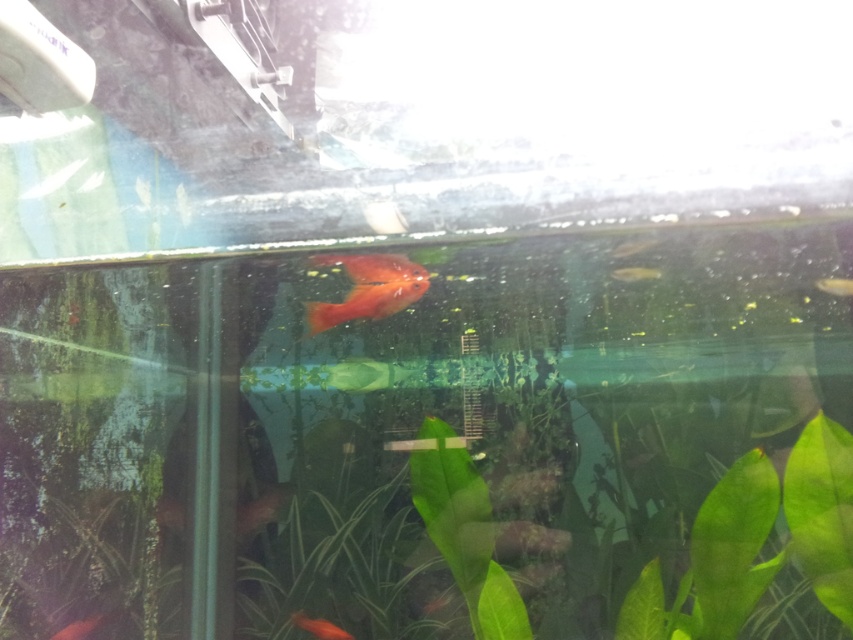
Question: Estimate the real-world distances between objects in this image. Which object is farther from the translucent yellowish-green leaf at center?

Choices:
 (A) shiny orange fish at lower left
 (B) glossy orange fish at center
 (C) shiny orange fish at bottom
 (D) translucent yellowish fish at upper right

Answer: (A)

Question: Which of the following is the farthest from the observer?

Choices:
 (A) shiny orange fish at bottom
 (B) shiny orange fish at lower left

Answer: (A)

Question: Is shiny orange fish at upper center wider than shiny orange fish at center?

Choices:
 (A) yes
 (B) no

Answer: (A)

Question: Does shiny orange fish at bottom appear on the right side of shiny orange fish at center?

Choices:
 (A) no
 (B) yes

Answer: (B)

Question: Based on their relative distances, which object is farther from the translucent yellowish-green leaf at center?

Choices:
 (A) shiny orange fish at upper center
 (B) glossy orange fish at center
 (C) translucent yellowish fish at upper right
 (D) shiny orange fish at center

Answer: (D)

Question: Observing the image, what is the correct spatial positioning of shiny orange fish at bottom in reference to shiny orange fish at upper center?

Choices:
 (A) left
 (B) right

Answer: (A)